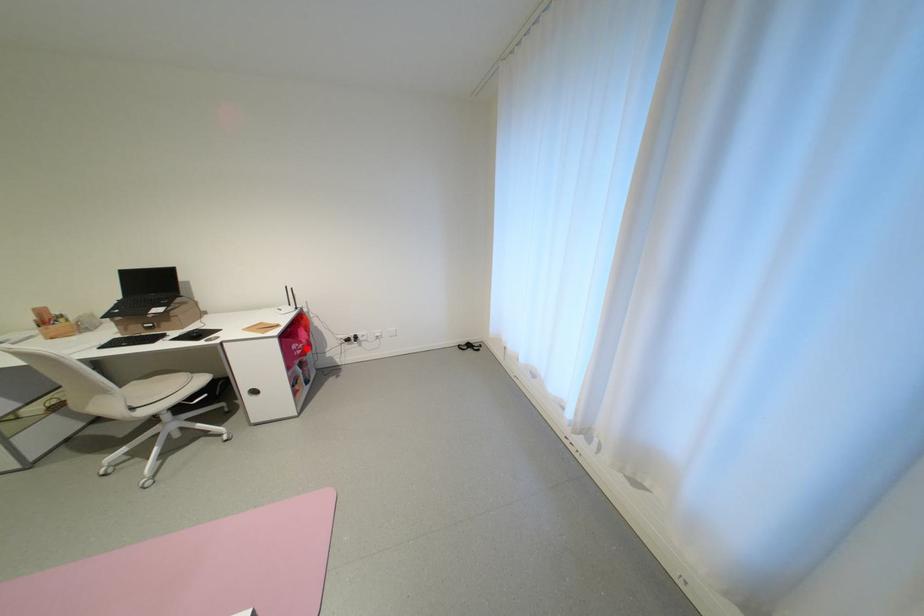
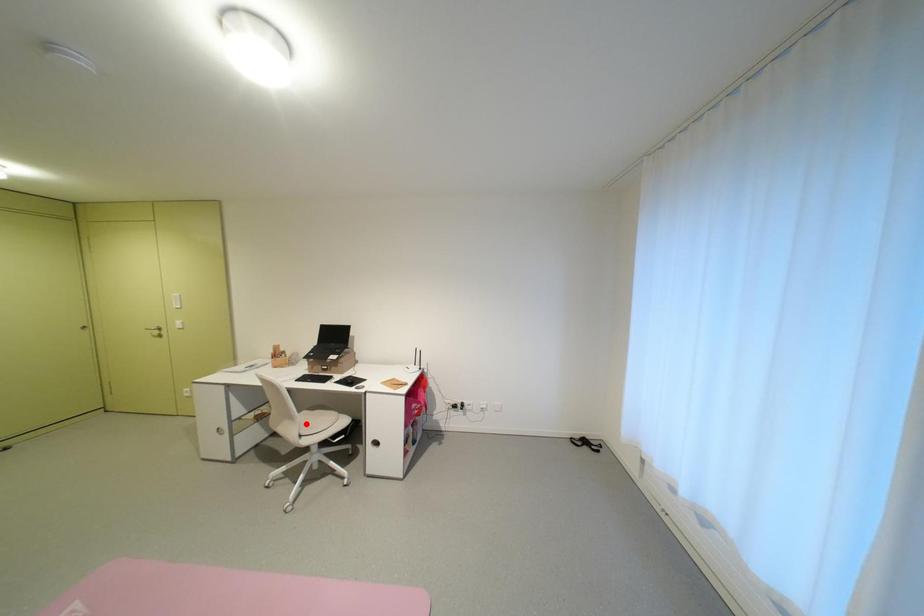
I am providing you with two images of the same scene from different viewpoints. A red point is marked on the first image and another point is marked on the second image. Is the marked point in image1 the same physical position as the marked point in image2?

No